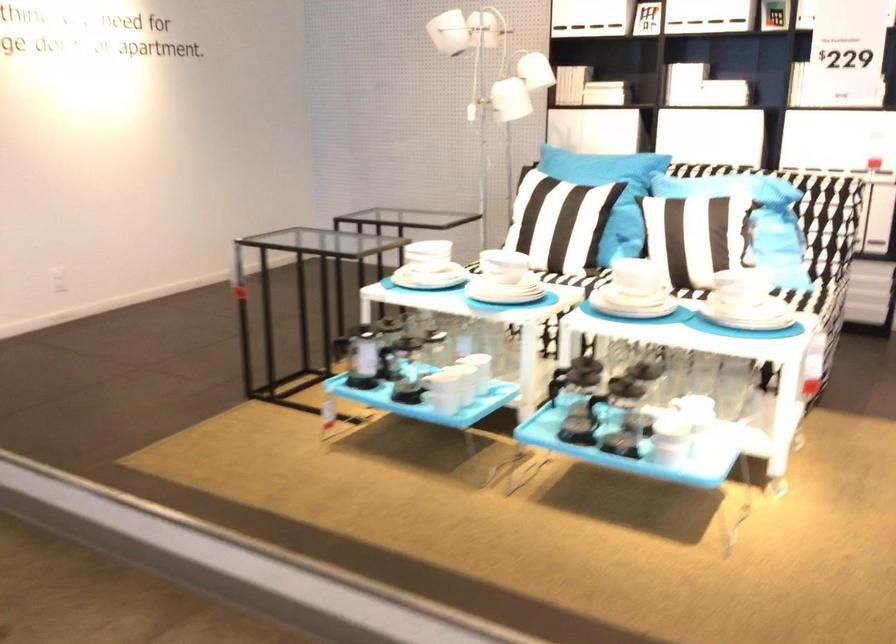
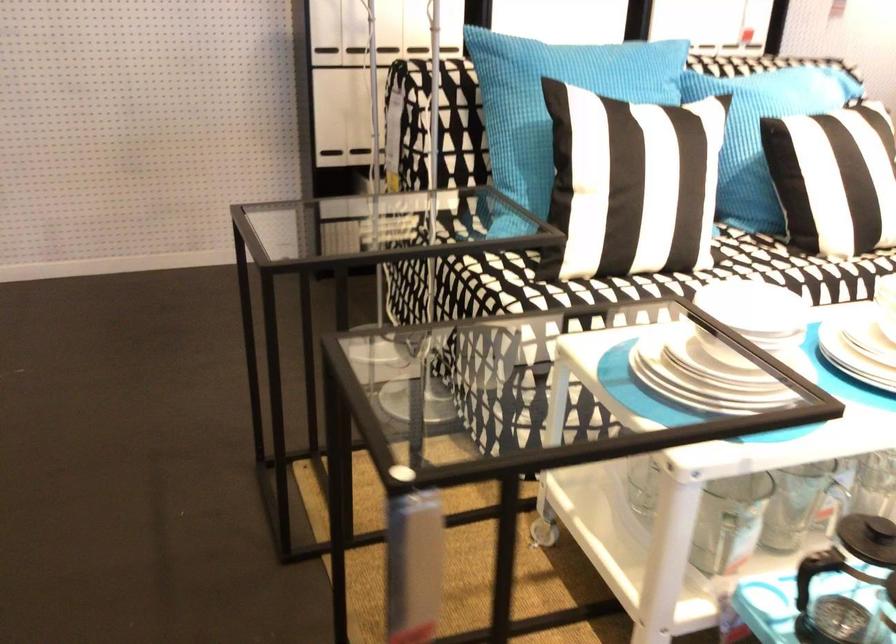
Find the pixel in the second image that matches point (535, 207) in the first image.

(617, 180)